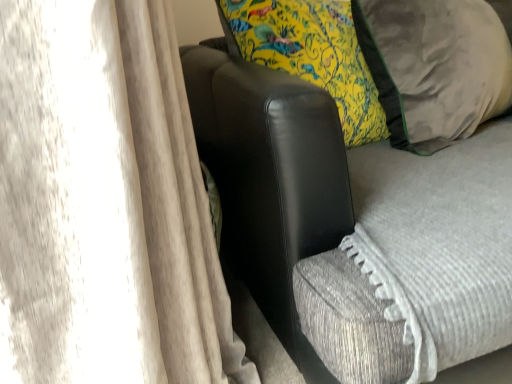
Question: From a real-world perspective, is black leather armchair at center physically located above or below suede-like beige pillow at right?

Choices:
 (A) above
 (B) below

Answer: (B)

Question: Considering the positions of black leather armchair at center and suede-like beige pillow at right in the image, is black leather armchair at center wider or thinner than suede-like beige pillow at right?

Choices:
 (A) wide
 (B) thin

Answer: (A)

Question: Is point (300, 241) closer or farther from the camera than point (406, 112)?

Choices:
 (A) farther
 (B) closer

Answer: (B)

Question: Is suede-like beige pillow at right wider or thinner than black leather armchair at center?

Choices:
 (A) thin
 (B) wide

Answer: (A)

Question: Considering the positions of suede-like beige pillow at right and black leather armchair at center in the image, is suede-like beige pillow at right taller or shorter than black leather armchair at center?

Choices:
 (A) short
 (B) tall

Answer: (A)

Question: From a real-world perspective, is suede-like beige pillow at right physically located above or below black leather armchair at center?

Choices:
 (A) above
 (B) below

Answer: (A)

Question: Is suede-like beige pillow at right inside or outside of black leather armchair at center?

Choices:
 (A) inside
 (B) outside

Answer: (A)